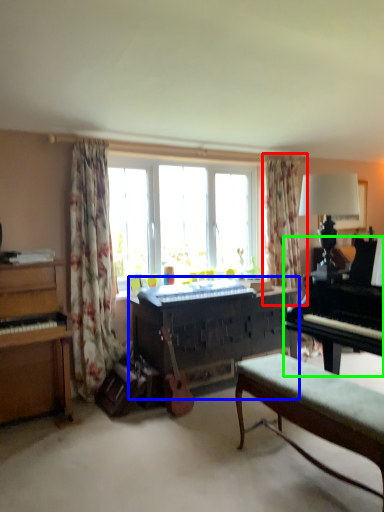
Question: Which object is the closest to the curtain (highlighted by a red box)? Choose among these: piano (highlighted by a blue box) or piano (highlighted by a green box).

Choices:
 (A) piano
 (B) piano

Answer: (A)